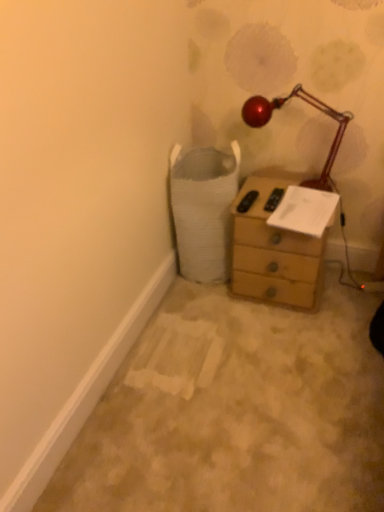
Image resolution: width=384 pixels, height=512 pixels. Identify the location of vacant area on top of white paper at upper right (from a real-world perspective). [307, 199].